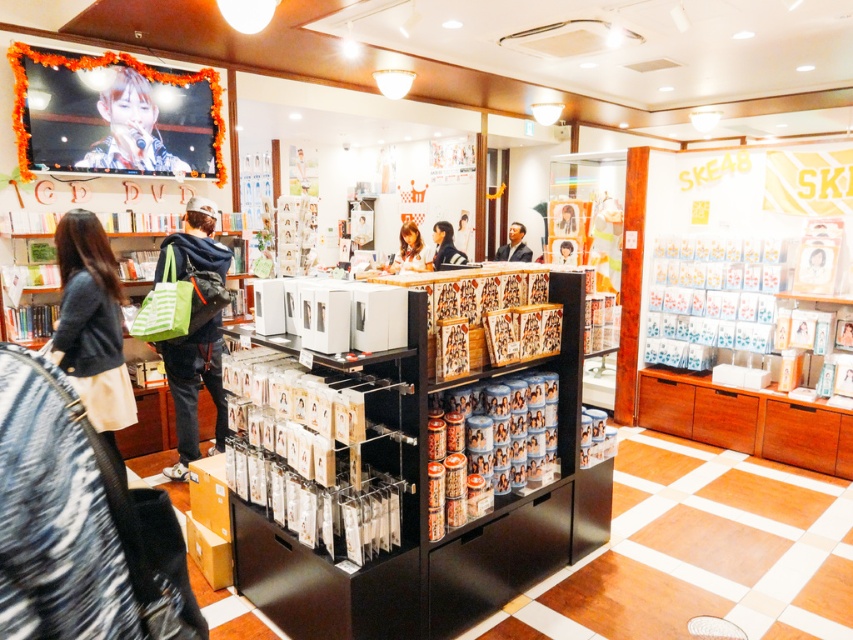
You are a customer in the store and want to reach the dark blue suit at center from the smooth brown hair at center. The store has a cleaning robot that is 1 meter wide. Can the robot move through the space between them?

The distance between smooth brown hair at center and dark blue suit at center is 1.12 meters. Since the robot is 1 meter wide, it can pass through the space as the distance is wider than the robot.

You are standing at the entrance of the SKE48 store and see a smooth brown hair at center. There is also a black shelving unit in the foreground. How far apart are these two items?

The smooth brown hair at center and the black shelving unit in the foreground are 6.56 meters apart.